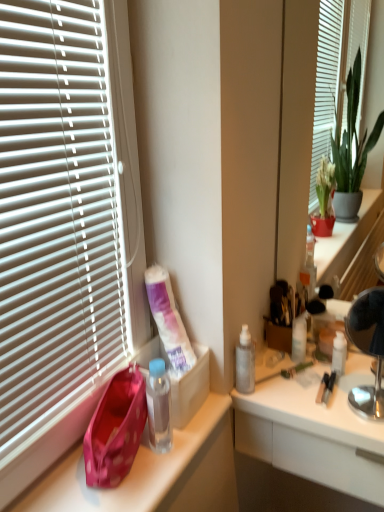
You are a GUI agent. You are given a task and a screenshot of the screen. Output one action in this format:
    pyautogui.click(x=<x>, y=<y>)
    Task: Click on the metallic silver mirror at right
    
    Given the screenshot: What is the action you would take?
    coord(296,132)

What do you see at coordinates (168, 319) in the screenshot? This screenshot has height=512, width=384. I see `white matte tube at lower left` at bounding box center [168, 319].

What do you see at coordinates (245, 362) in the screenshot? This screenshot has width=384, height=512. I see `transparent plastic bottle at center-right` at bounding box center [245, 362].

The width and height of the screenshot is (384, 512). Describe the element at coordinates (368, 348) in the screenshot. I see `metallic silver lamp at right` at that location.

Describe the element at coordinates (116, 429) in the screenshot. I see `pink fabric handbag at left` at that location.

At what (x,y) coordinates should I click in order to perform the action: click on translucent plastic bottle at upper right. Please return your answer as a coordinate pair (x, y). Looking at the image, I should click on (299, 338).

Considering the sizes of objects translucent plastic bottle at upper right and transparent plastic bottle at center-right in the image provided, who is taller, translucent plastic bottle at upper right or transparent plastic bottle at center-right?

Standing taller between the two is transparent plastic bottle at center-right.

Locate an element on the screen. toiletry on the right of transparent plastic bottle at center-right is located at coordinates (299, 338).

Between translucent plastic bottle at upper right and transparent plastic bottle at center-right, which one has smaller width?

translucent plastic bottle at upper right.

Considering the positions of objects translucent plastic bottle at upper right and transparent plastic bottle at center-right in the image provided, who is in front, translucent plastic bottle at upper right or transparent plastic bottle at center-right?

transparent plastic bottle at center-right is more forward.

Which object is closer to the camera taking this photo, metallic silver mirror at right or metallic silver lamp at right?

Positioned in front is metallic silver lamp at right.

Considering the relative positions of metallic silver mirror at right and metallic silver lamp at right in the image provided, is metallic silver mirror at right to the left of metallic silver lamp at right from the viewer's perspective?

Yes.

Considering the relative sizes of metallic silver mirror at right and metallic silver lamp at right in the image provided, is metallic silver mirror at right smaller than metallic silver lamp at right?

No.

Are metallic silver mirror at right and metallic silver lamp at right located far from each other?

metallic silver mirror at right is near metallic silver lamp at right, not far away.

Does translucent plastic bottles at center appear on the left side of translucent plastic bottle at upper right?

No, translucent plastic bottles at center is not to the left of translucent plastic bottle at upper right.

What are the coordinates of `toiletry above the translucent plastic bottles at center (from the image's perspective)` in the screenshot? It's located at (299, 338).

Is translucent plastic bottles at center thinner than translucent plastic bottle at upper right?

Incorrect, the width of translucent plastic bottles at center is not less than that of translucent plastic bottle at upper right.

Based on the photo, from the image's perspective, which is below, translucent plastic bottles at center or translucent plastic bottle at upper right?

translucent plastic bottles at center appears lower in the image.

From a real-world perspective, is metallic silver lamp at right positioned above or below metallic silver mirror at right?

Clearly, from a real-world perspective, metallic silver lamp at right is below metallic silver mirror at right.

Is metallic silver lamp at right taller than metallic silver mirror at right?

No, metallic silver lamp at right is not taller than metallic silver mirror at right.

Can we say metallic silver lamp at right lies outside metallic silver mirror at right?

metallic silver lamp at right lies outside metallic silver mirror at right's area.

Does metallic silver lamp at right come behind metallic silver mirror at right?

That is False.

From the image's perspective, is transparent plastic bottle at center-right located above white matte tube at lower left?

No.

Which is in front, point (243, 359) or point (152, 280)?

Positioned in front is point (152, 280).

From a real-world perspective, who is located lower, pink fabric handbag at left or metallic silver mirror at right?

pink fabric handbag at left.

Consider the image. Considering the relative positions of pink fabric handbag at left and metallic silver mirror at right in the image provided, is pink fabric handbag at left to the left or to the right of metallic silver mirror at right?

pink fabric handbag at left is to the left of metallic silver mirror at right.

Looking at this image, is metallic silver mirror at right at the back of pink fabric handbag at left?

No, metallic silver mirror at right is not at the back of pink fabric handbag at left.

Is white matte tube at lower left taller or shorter than translucent plastic bottles at center?

Considering their sizes, white matte tube at lower left has more height than translucent plastic bottles at center.

From a real-world perspective, is white matte tube at lower left positioned above or below translucent plastic bottles at center?

From a real-world perspective, white matte tube at lower left is physically above translucent plastic bottles at center.

What are the coordinates of `toothpaste above the translucent plastic bottles at center (from a real-world perspective)` in the screenshot? It's located at (168, 319).

Where is `toiletry that is under the transparent plastic bottle at center-right (from a real-world perspective)`? This screenshot has width=384, height=512. toiletry that is under the transparent plastic bottle at center-right (from a real-world perspective) is located at coordinates (299, 338).

Where is `lamp that appears on the right of metallic silver mirror at right`? The width and height of the screenshot is (384, 512). lamp that appears on the right of metallic silver mirror at right is located at coordinates (368, 348).

From the image, which object appears to be farther from pink fabric handbag at left, transparent plastic bottle at center-right or metallic silver mirror at right?

metallic silver mirror at right lies further to pink fabric handbag at left than the other object.

Estimate the real-world distances between objects in this image. Which object is closer to white matte tube at lower left, translucent plastic bottle at upper right or pink fabric handbag at left?

pink fabric handbag at left lies closer to white matte tube at lower left than the other object.

Based on their spatial positions, is transparent plastic bottle at center-right or white matte tube at lower left closer to metallic silver mirror at right?

The object closer to metallic silver mirror at right is transparent plastic bottle at center-right.

Which object lies further to the anchor point metallic silver mirror at right, translucent plastic bottle at upper right or metallic silver lamp at right?

metallic silver lamp at right is further to metallic silver mirror at right.

From the image, which object appears to be nearer to translucent plastic bottles at center, pink fabric handbag at left or metallic silver lamp at right?

metallic silver lamp at right is closer to translucent plastic bottles at center.

From the image, which object appears to be farther from translucent plastic bottles at center, metallic silver lamp at right or white matte tube at lower left?

Among the two, white matte tube at lower left is located further to translucent plastic bottles at center.

Estimate the real-world distances between objects in this image. Which object is closer to translucent plastic bottles at center, metallic silver lamp at right or translucent plastic bottle at upper right?

metallic silver lamp at right.

Considering their positions, is white matte tube at lower left positioned further to metallic silver lamp at right than pink fabric handbag at left?

pink fabric handbag at left is further to metallic silver lamp at right.

Where is `lamp between metallic silver mirror at right and translucent plastic bottles at center vertically`? lamp between metallic silver mirror at right and translucent plastic bottles at center vertically is located at coordinates (368, 348).

Find the location of `toiletry located between white matte tube at lower left and metallic silver mirror at right in the left-right direction`. toiletry located between white matte tube at lower left and metallic silver mirror at right in the left-right direction is located at coordinates (299, 338).

Find the location of `toothpaste between metallic silver mirror at right and transparent plastic bottle at center-right vertically`. toothpaste between metallic silver mirror at right and transparent plastic bottle at center-right vertically is located at coordinates (168, 319).

This screenshot has width=384, height=512. I want to click on toothpaste between pink fabric handbag at left and metallic silver mirror at right, so click(168, 319).